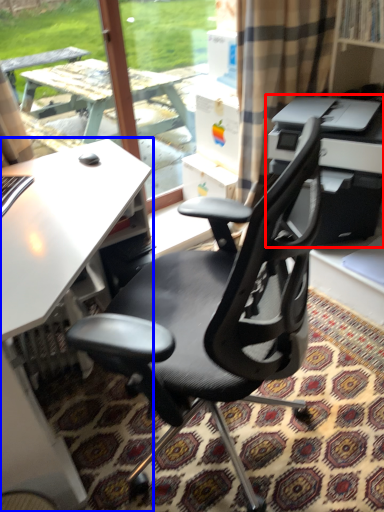
Question: Among these objects, which one is farthest to the camera, printer (highlighted by a red box) or desk (highlighted by a blue box)?

Choices:
 (A) printer
 (B) desk

Answer: (A)